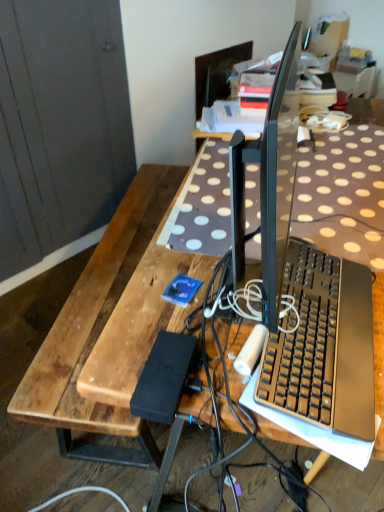
Question: From the image's perspective, is brown wooden bench at left positioned above or below black plastic keyboard at center?

Choices:
 (A) below
 (B) above

Answer: (A)

Question: From a real-world perspective, is brown wooden bench at left positioned above or below black plastic keyboard at center?

Choices:
 (A) above
 (B) below

Answer: (B)

Question: Is point (104, 251) closer or farther from the camera than point (332, 400)?

Choices:
 (A) farther
 (B) closer

Answer: (A)

Question: Is black plastic keyboard at center spatially inside brown wooden bench at left, or outside of it?

Choices:
 (A) inside
 (B) outside

Answer: (B)

Question: Is black plastic keyboard at center bigger or smaller than brown wooden bench at left?

Choices:
 (A) big
 (B) small

Answer: (B)

Question: From the image's perspective, is black plastic keyboard at center positioned above or below brown wooden bench at left?

Choices:
 (A) below
 (B) above

Answer: (B)

Question: Relative to brown wooden bench at left, is black plastic keyboard at center in front or behind?

Choices:
 (A) behind
 (B) front

Answer: (B)